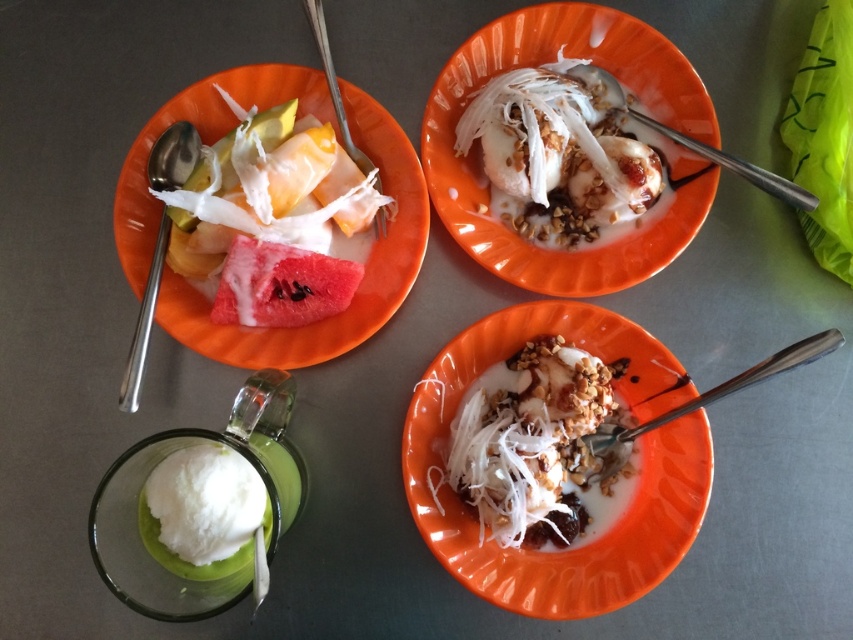
Question: Can you confirm if orange matte bowl at center is thinner than white creamy ice cream at center?

Choices:
 (A) yes
 (B) no

Answer: (B)

Question: Which object is the farthest from the white creamy dessert at center?

Choices:
 (A) matte orange plate at upper left
 (B) white creamy ice cream at center

Answer: (A)

Question: Is matte orange plate at upper left positioned at the back of white creamy ice cream at center?

Choices:
 (A) yes
 (B) no

Answer: (B)

Question: Is orange matte bowl at center wider than matte orange plate at upper left?

Choices:
 (A) no
 (B) yes

Answer: (A)

Question: Which object is positioned farthest from the orange matte bowl at center?

Choices:
 (A) white creamy dessert at center
 (B) matte orange plate at upper left
 (C) white creamy ice cream at center

Answer: (B)

Question: Which object is positioned farthest from the matte orange plate at upper left?

Choices:
 (A) white creamy dessert at center
 (B) orange matte bowl at center
 (C) white creamy ice cream at center

Answer: (A)